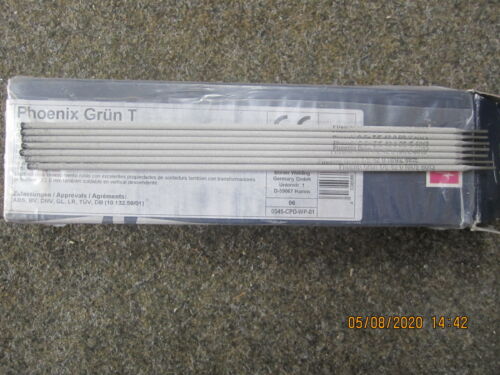
This screenshot has width=500, height=375. Find the location of `grainy countertop`. grainy countertop is located at coordinates (212, 266).